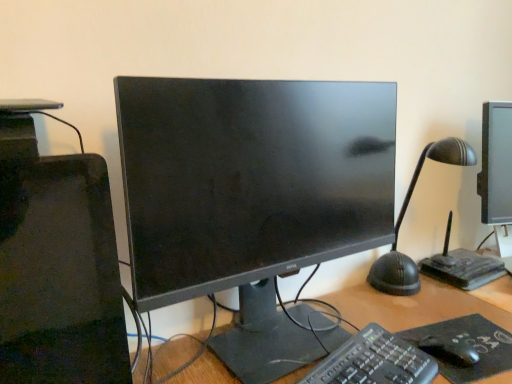
Question: Is matte black monitor at center taller than black plastic keyboard at center?

Choices:
 (A) yes
 (B) no

Answer: (A)

Question: Considering the relative positions of matte black monitor at center and black plastic keyboard at center in the image provided, is matte black monitor at center behind black plastic keyboard at center?

Choices:
 (A) no
 (B) yes

Answer: (B)

Question: Is matte black monitor at center oriented towards black plastic keyboard at center?

Choices:
 (A) no
 (B) yes

Answer: (B)

Question: Are matte black monitor at center and black plastic keyboard at center far apart?

Choices:
 (A) no
 (B) yes

Answer: (A)

Question: Can we say matte black monitor at center lies outside black plastic keyboard at center?

Choices:
 (A) yes
 (B) no

Answer: (A)

Question: From the image's perspective, is matte black monitor at center positioned above or below black matte mousepad at lower right?

Choices:
 (A) below
 (B) above

Answer: (B)

Question: From a real-world perspective, is matte black monitor at center positioned above or below black matte mousepad at lower right?

Choices:
 (A) above
 (B) below

Answer: (A)

Question: Considering the positions of matte black monitor at center and black matte mousepad at lower right in the image, is matte black monitor at center taller or shorter than black matte mousepad at lower right?

Choices:
 (A) tall
 (B) short

Answer: (A)

Question: Is matte black monitor at center in front of or behind black matte mousepad at lower right in the image?

Choices:
 (A) front
 (B) behind

Answer: (A)

Question: In terms of width, does black matte mouse at lower right look wider or thinner when compared to black plastic keyboard at center?

Choices:
 (A) thin
 (B) wide

Answer: (A)

Question: In the image, is black matte mouse at lower right positioned in front of or behind black plastic keyboard at center?

Choices:
 (A) front
 (B) behind

Answer: (B)

Question: Is black matte mouse at lower right situated inside black plastic keyboard at center or outside?

Choices:
 (A) outside
 (B) inside

Answer: (A)

Question: From the image's perspective, relative to black plastic keyboard at center, is black matte mouse at lower right above or below?

Choices:
 (A) below
 (B) above

Answer: (B)

Question: Is black plastic keyboard at center to the left or to the right of black matte mouse at lower right in the image?

Choices:
 (A) right
 (B) left

Answer: (B)

Question: Considering the positions of black plastic keyboard at center and black matte mouse at lower right in the image, is black plastic keyboard at center wider or thinner than black matte mouse at lower right?

Choices:
 (A) wide
 (B) thin

Answer: (A)